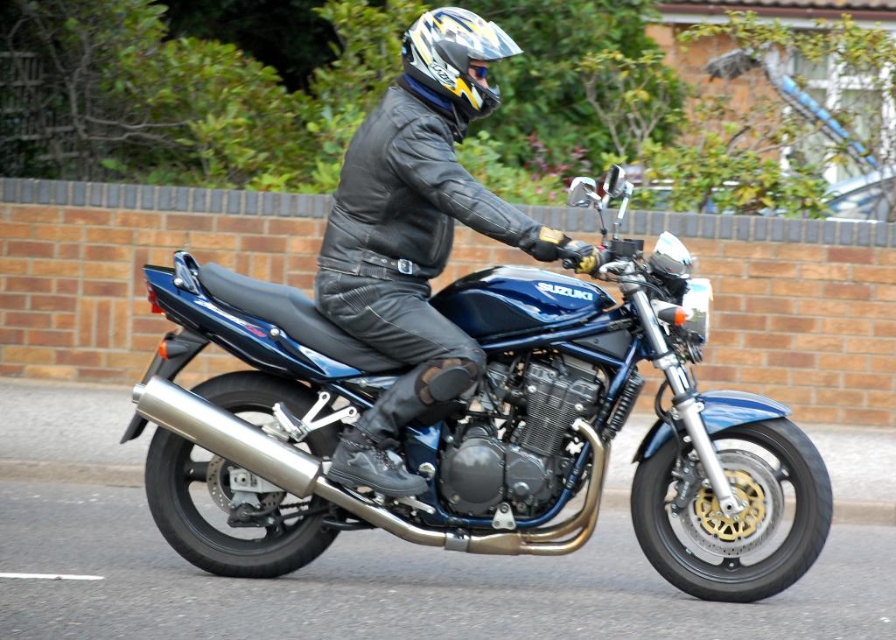
Question: Which point is farther to the camera?

Choices:
 (A) shiny multicolored helmet at center
 (B) matte black leather jacket at center
 (C) blue metallic motorcycle at center

Answer: (A)

Question: Does blue metallic motorcycle at center come in front of shiny multicolored helmet at center?

Choices:
 (A) no
 (B) yes

Answer: (B)

Question: Is matte black leather jacket at center positioned in front of shiny multicolored helmet at center?

Choices:
 (A) no
 (B) yes

Answer: (B)

Question: Which object appears closest to the camera in this image?

Choices:
 (A) shiny multicolored helmet at center
 (B) matte black leather jacket at center
 (C) blue metallic motorcycle at center

Answer: (B)

Question: Estimate the real-world distances between objects in this image. Which object is closer to the blue metallic motorcycle at center?

Choices:
 (A) shiny multicolored helmet at center
 (B) matte black leather jacket at center

Answer: (B)

Question: In this image, where is blue metallic motorcycle at center located relative to shiny multicolored helmet at center?

Choices:
 (A) below
 (B) above

Answer: (A)